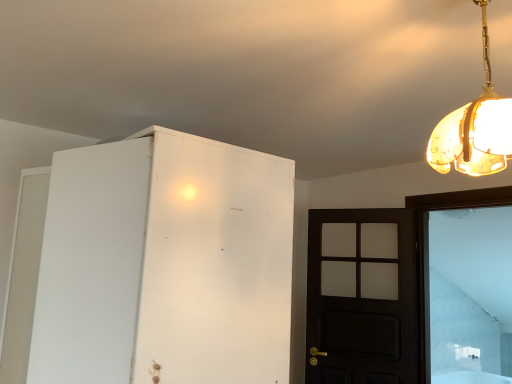
Question: Would you say white glass door at right is outside dark wood door at right?

Choices:
 (A) yes
 (B) no

Answer: (A)

Question: Is white glass door at right thinner than dark wood door at right?

Choices:
 (A) yes
 (B) no

Answer: (B)

Question: Does white glass door at right come behind dark wood door at right?

Choices:
 (A) no
 (B) yes

Answer: (A)

Question: Considering the relative sizes of white glass door at right and dark wood door at right in the image provided, is white glass door at right shorter than dark wood door at right?

Choices:
 (A) yes
 (B) no

Answer: (B)

Question: From the image's perspective, is white glass door at right located above dark wood door at right?

Choices:
 (A) no
 (B) yes

Answer: (B)

Question: Considering the positions of white glass door at right and translucent amber glass pendant light at upper right in the image, is white glass door at right taller or shorter than translucent amber glass pendant light at upper right?

Choices:
 (A) tall
 (B) short

Answer: (A)

Question: Is white glass door at right in front of or behind translucent amber glass pendant light at upper right in the image?

Choices:
 (A) front
 (B) behind

Answer: (B)

Question: From a real-world perspective, relative to translucent amber glass pendant light at upper right, is white glass door at right vertically above or below?

Choices:
 (A) below
 (B) above

Answer: (A)

Question: Looking at the image, does white glass door at right seem bigger or smaller compared to translucent amber glass pendant light at upper right?

Choices:
 (A) small
 (B) big

Answer: (B)

Question: Is translucent amber glass pendant light at upper right to the left or to the right of white matte cabinet at left in the image?

Choices:
 (A) left
 (B) right

Answer: (B)

Question: Considering their positions, is translucent amber glass pendant light at upper right located in front of or behind white matte cabinet at left?

Choices:
 (A) front
 (B) behind

Answer: (A)

Question: From a real-world perspective, relative to white matte cabinet at left, is translucent amber glass pendant light at upper right vertically above or below?

Choices:
 (A) below
 (B) above

Answer: (B)

Question: Looking at their shapes, would you say translucent amber glass pendant light at upper right is wider or thinner than white matte cabinet at left?

Choices:
 (A) thin
 (B) wide

Answer: (A)

Question: From their relative heights in the image, would you say dark wood door at right is taller or shorter than white glass door at right?

Choices:
 (A) short
 (B) tall

Answer: (A)

Question: From a real-world perspective, is dark wood door at right physically located above or below white glass door at right?

Choices:
 (A) above
 (B) below

Answer: (B)